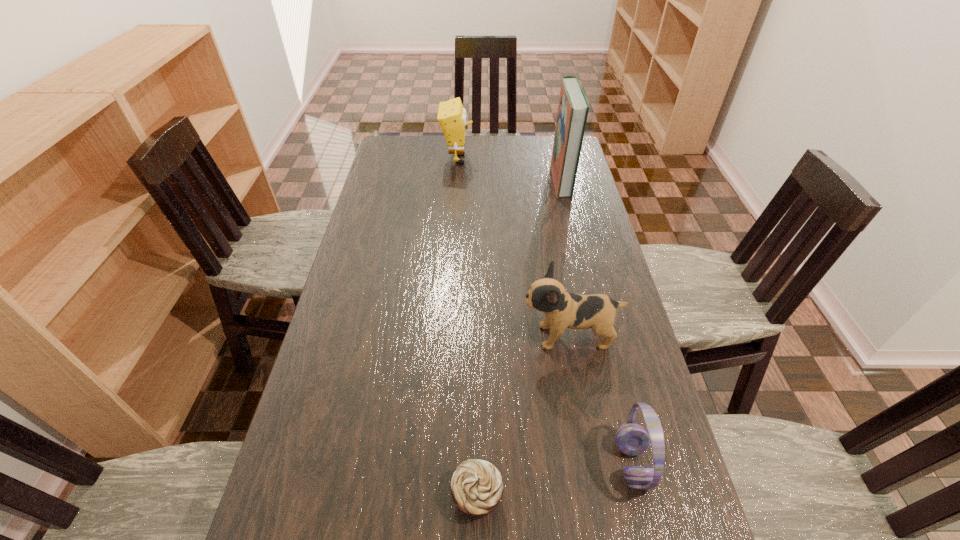
Identify the location of vacant space situated 0.070m at the face of the puppy. The width and height of the screenshot is (960, 540). (494, 336).

You are a GUI agent. You are given a task and a screenshot of the screen. Output one action in this format:
    pyautogui.click(x=<x>, y=<y>)
    Task: Click on the vacant space located at the face of the puppy
    
    Given the screenshot: What is the action you would take?
    pyautogui.click(x=476, y=336)

This screenshot has height=540, width=960. I want to click on vacant space positioned on the headband and ear cups of the headset, so click(x=443, y=463).

Identify the location of vacant space located on the headband and ear cups of the headset. The height and width of the screenshot is (540, 960). (532, 463).

I want to click on free space located on the headband and ear cups of the headset, so (x=555, y=463).

Find the location of a particular element. This screenshot has width=960, height=540. free space located 0.160m on the right of the shortest object is located at coordinates (582, 495).

Image resolution: width=960 pixels, height=540 pixels. I want to click on hardback book that is at the far edge, so click(573, 107).

Find the location of a particular element. The image size is (960, 540). sponge at the far edge is located at coordinates (452, 117).

Locate an element on the screen. This screenshot has width=960, height=540. hardback book at the right edge is located at coordinates (573, 107).

Identify the location of puppy that is at the right edge. The width and height of the screenshot is (960, 540). (563, 310).